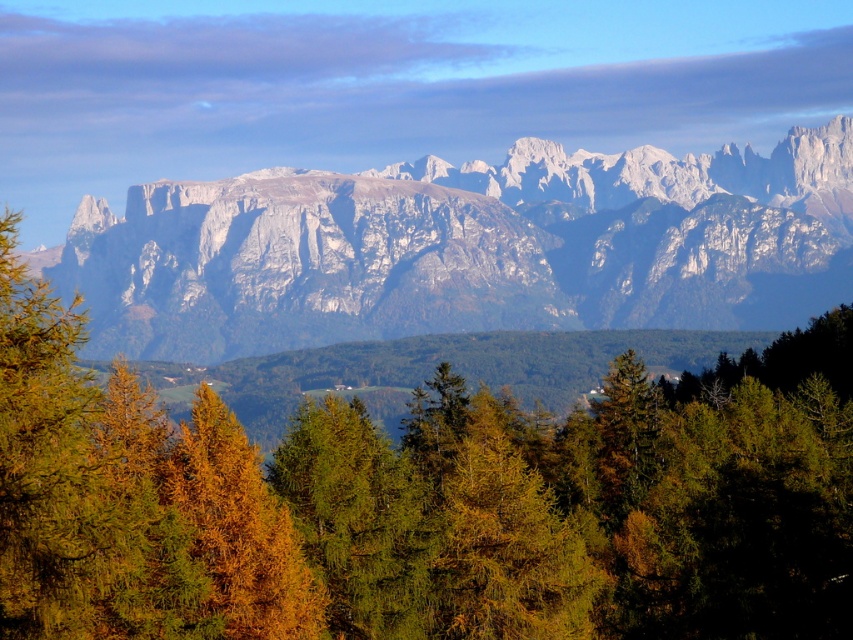
Does green matte tree at center appear on the left side of white rocky mountain range at upper center?

Indeed, green matte tree at center is positioned on the left side of white rocky mountain range at upper center.

Is green matte tree at center below white rocky mountain range at upper center?

Indeed, green matte tree at center is positioned under white rocky mountain range at upper center.

The height and width of the screenshot is (640, 853). Describe the element at coordinates (424, 502) in the screenshot. I see `green matte tree at center` at that location.

Identify the location of green matte tree at center. The width and height of the screenshot is (853, 640). [x=424, y=502].